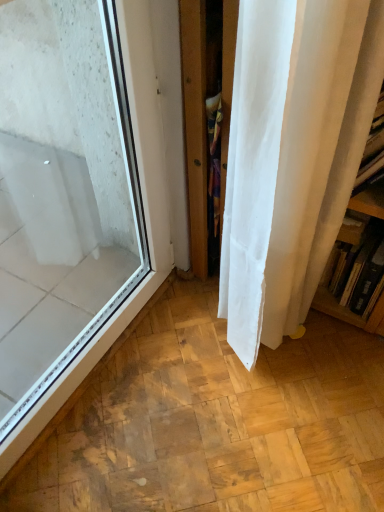
Question: Is transparent glass window at left not close to wooden bookshelf at right?

Choices:
 (A) no
 (B) yes

Answer: (A)

Question: Does transparent glass window at left have a lesser height compared to wooden bookshelf at right?

Choices:
 (A) no
 (B) yes

Answer: (A)

Question: Considering the relative sizes of transparent glass window at left and wooden bookshelf at right in the image provided, is transparent glass window at left bigger than wooden bookshelf at right?

Choices:
 (A) no
 (B) yes

Answer: (B)

Question: Is transparent glass window at left at the left side of wooden bookshelf at right?

Choices:
 (A) yes
 (B) no

Answer: (A)

Question: From a real-world perspective, is transparent glass window at left positioned over wooden bookshelf at right based on gravity?

Choices:
 (A) yes
 (B) no

Answer: (A)

Question: Does transparent glass window at left turn towards wooden bookshelf at right?

Choices:
 (A) no
 (B) yes

Answer: (A)

Question: From a real-world perspective, is wooden bookshelf at right on transparent glass window at left?

Choices:
 (A) yes
 (B) no

Answer: (B)

Question: Does wooden bookshelf at right have a lesser width compared to transparent glass window at left?

Choices:
 (A) no
 (B) yes

Answer: (A)

Question: Does wooden bookshelf at right have a larger size compared to transparent glass window at left?

Choices:
 (A) no
 (B) yes

Answer: (A)

Question: Does wooden bookshelf at right have a lesser height compared to transparent glass window at left?

Choices:
 (A) no
 (B) yes

Answer: (B)

Question: Considering the relative sizes of wooden bookshelf at right and transparent glass window at left in the image provided, is wooden bookshelf at right wider than transparent glass window at left?

Choices:
 (A) no
 (B) yes

Answer: (B)

Question: Is wooden bookshelf at right facing towards transparent glass window at left?

Choices:
 (A) yes
 (B) no

Answer: (B)

Question: Would you say transparent glass window at left is to the left or to the right of wooden bookshelf at right in the picture?

Choices:
 (A) right
 (B) left

Answer: (B)